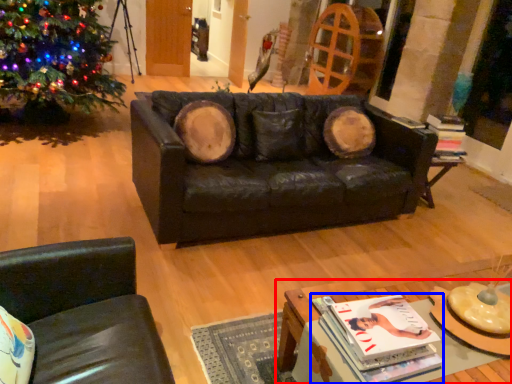
Question: Among these objects, which one is farthest to the camera, table (highlighted by a red box) or magazine (highlighted by a blue box)?

Choices:
 (A) table
 (B) magazine

Answer: (B)